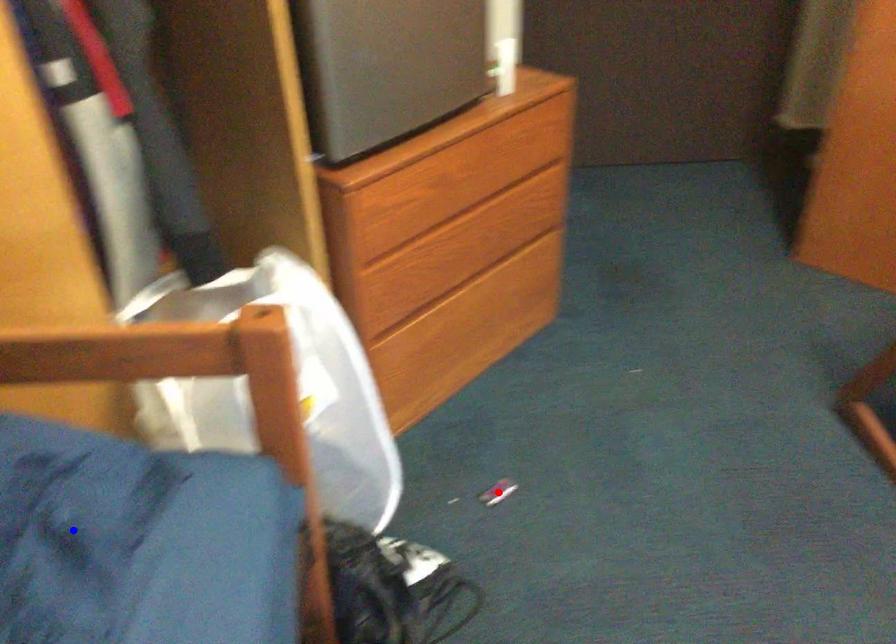
Question: Which of the two points in the image is closer to the camera?

Choices:
 (A) Blue point is closer.
 (B) Red point is closer.

Answer: (A)